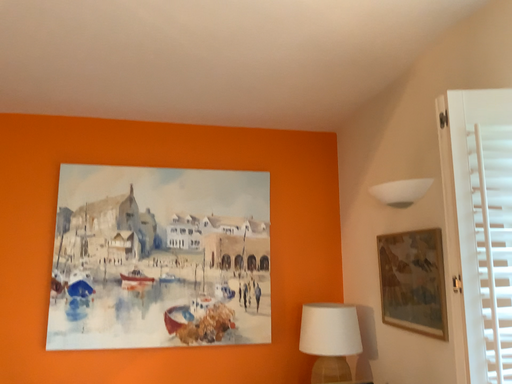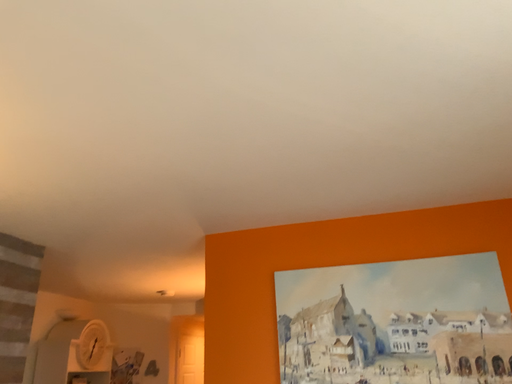
Question: How did the camera likely rotate when shooting the video?

Choices:
 (A) rotated right
 (B) rotated left

Answer: (B)